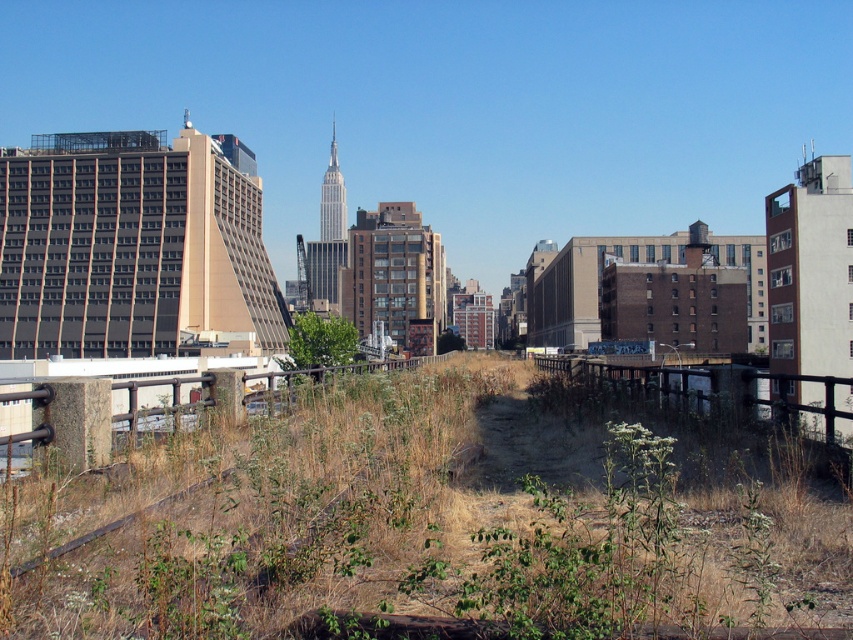
You are a drone operator trying to capture a clear photo of the Empire State Building lookalike in the midground. You notice the dry grass at center and the green leafy tree at center might block the view. Which object is closer to the camera and could obstruct the photo?

The dry grass at center is in front of the green leafy tree at center, so it is closer to the camera and would obstruct the photo.

You are a gardener looking to plant a new tree in the urban landscape. You notice the dry grass at center and the green leafy tree at center. Which object is positioned to the right of the other?

The dry grass at center is to the right of the green leafy tree at center.

You are a gardener planning to plant a new row of flowers between the dry grass at center and the green leafy tree at center. Given their widths, which area would require more space to accommodate the flowers?

The green leafy tree at center requires more space because its width is greater than the dry grass at center.